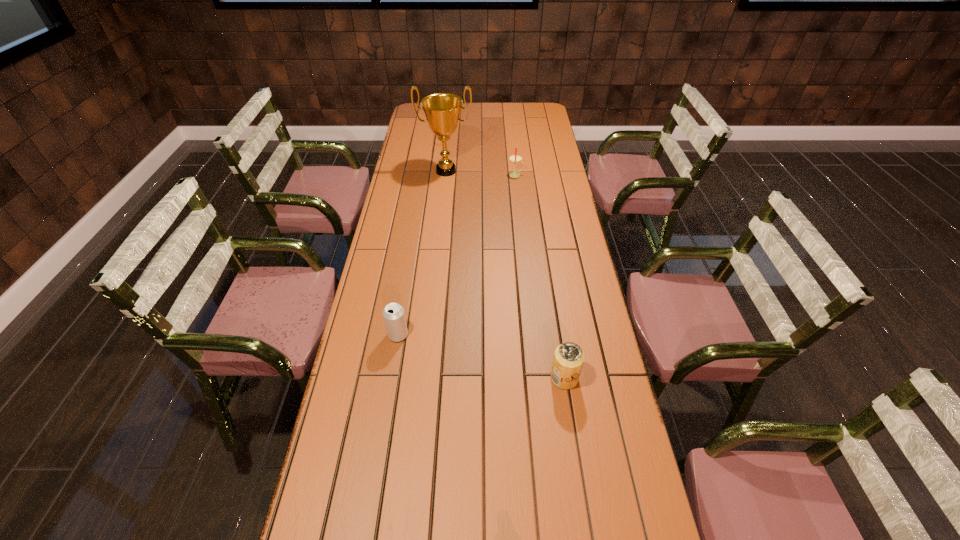
Locate an element on the screen. This screenshot has height=540, width=960. award at the left edge is located at coordinates (442, 110).

Where is `beer can located in the left edge section of the desktop`? beer can located in the left edge section of the desktop is located at coordinates (394, 316).

Identify the location of object that is at the right edge. (568, 360).

I want to click on free region at the left edge of the desktop, so (x=434, y=139).

This screenshot has height=540, width=960. Find the location of `vacant space at the right edge of the desktop`. vacant space at the right edge of the desktop is located at coordinates (612, 530).

Locate an element on the screen. vacant region between the award and the nearest object is located at coordinates (505, 274).

Locate an element on the screen. Image resolution: width=960 pixels, height=540 pixels. vacant point located between the second object from right to left and the tallest object is located at coordinates (481, 173).

This screenshot has width=960, height=540. Identify the location of free space between the rightmost object and the tallest object. (505, 274).

Identify the location of free space between the left beer can and the tallest object. This screenshot has width=960, height=540. (422, 253).

The image size is (960, 540). What are the coordinates of `empty space that is in between the nearer beer can and the farther beer can` in the screenshot? It's located at (481, 356).